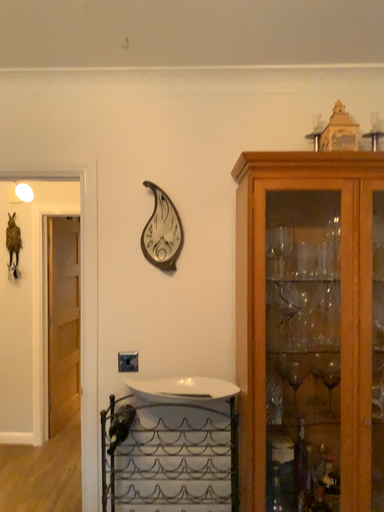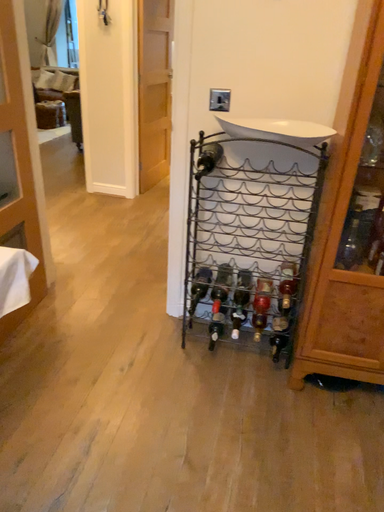
Question: How did the camera likely rotate when shooting the video?

Choices:
 (A) rotated right
 (B) rotated left

Answer: (B)